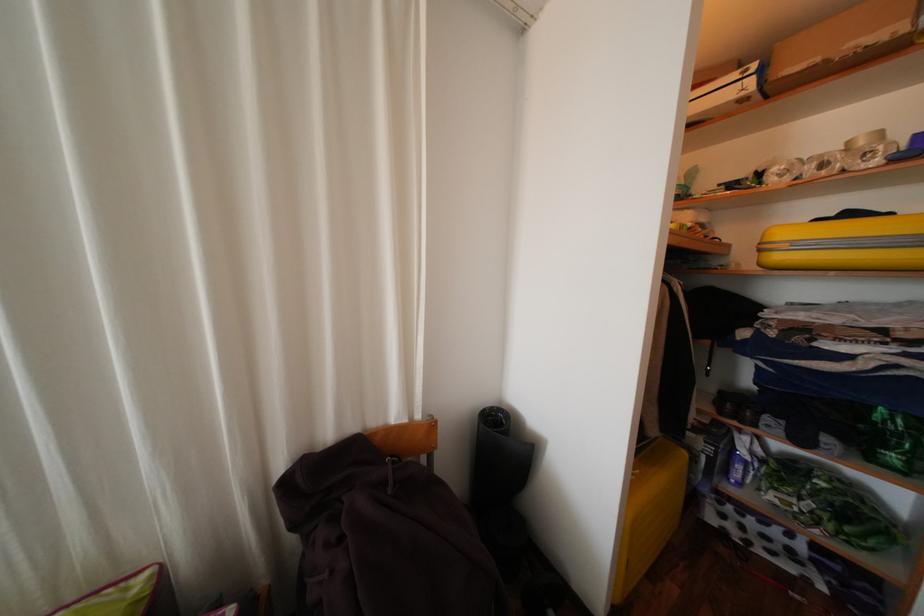
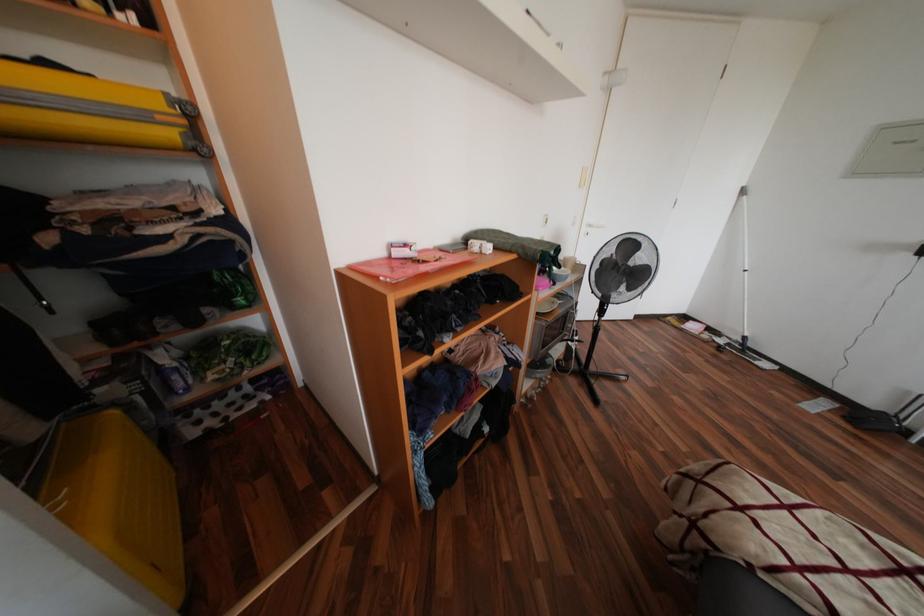
First-person continuous shooting, in which direction is the camera rotating?

The camera's rotation is toward right-down.